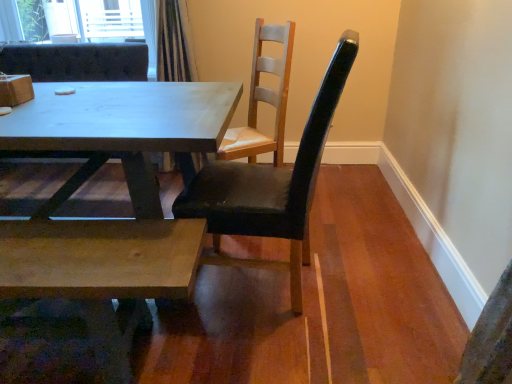
This screenshot has width=512, height=384. What do you see at coordinates (129, 194) in the screenshot? I see `matte wood table at center` at bounding box center [129, 194].

Measure the distance between point (250, 84) and camera.

Point (250, 84) is 2.81 meters from camera.

In order to click on matte white chair at center, arranged as the third chair when viewed from the right in this screenshot , I will do `click(77, 62)`.

This screenshot has width=512, height=384. What do you see at coordinates (271, 186) in the screenshot?
I see `black leather chair at center, acting as the 3th chair starting from the left` at bounding box center [271, 186].

In order to face black leather chair at center, acting as the 3th chair starting from the left, should I rotate leftwards or rightwards?

Rotate your view right by about 0.337°.

In order to click on matte wood table at center in this screenshot , I will do `click(129, 194)`.

Considering the sizes of objects light brown wood chair at upper center, the second chair when ordered from right to left, and natural wood coffee table at lower left in the image provided, who is wider, light brown wood chair at upper center, the second chair when ordered from right to left, or natural wood coffee table at lower left?

Wider between the two is light brown wood chair at upper center, the second chair when ordered from right to left.

Can you confirm if light brown wood chair at upper center, acting as the second chair starting from the left, is smaller than natural wood coffee table at lower left?

No, light brown wood chair at upper center, acting as the second chair starting from the left, is not smaller than natural wood coffee table at lower left.

Do you think light brown wood chair at upper center, the second chair when ordered from right to left, is within natural wood coffee table at lower left, or outside of it?

light brown wood chair at upper center, the second chair when ordered from right to left, is not enclosed by natural wood coffee table at lower left.

From the image's perspective, which chair is the 3rd one above the natural wood coffee table at lower left? Please provide its 2D coordinates.

[(263, 99)]

Is wooden box at upper left inside matte white chair at center, arranged as the third chair when viewed from the right?

No, wooden box at upper left is not inside matte white chair at center, arranged as the third chair when viewed from the right.

From the picture: From a real-world perspective, relative to wooden box at upper left, is matte white chair at center, placed as the 1th chair when sorted from left to right, vertically above or below?

Clearly, from a real-world perspective, matte white chair at center, placed as the 1th chair when sorted from left to right, is below wooden box at upper left.

Can you confirm if matte white chair at center, placed as the 1th chair when sorted from left to right, is taller than wooden box at upper left?

Yes, matte white chair at center, placed as the 1th chair when sorted from left to right, is taller than wooden box at upper left.

Could you tell me if matte white chair at center, arranged as the third chair when viewed from the right, is turned towards wooden box at upper left?

Yes, matte white chair at center, arranged as the third chair when viewed from the right, faces towards wooden box at upper left.

Is matte white chair at center, arranged as the third chair when viewed from the right, taller or shorter than natural wood coffee table at lower left?

Considering their sizes, matte white chair at center, arranged as the third chair when viewed from the right, has more height than natural wood coffee table at lower left.

In terms of size, does matte white chair at center, arranged as the third chair when viewed from the right, appear bigger or smaller than natural wood coffee table at lower left?

matte white chair at center, arranged as the third chair when viewed from the right, is bigger than natural wood coffee table at lower left.

Is matte white chair at center, placed as the 1th chair when sorted from left to right, positioned with its back to natural wood coffee table at lower left?

That's not correct — matte white chair at center, placed as the 1th chair when sorted from left to right, is not looking away from natural wood coffee table at lower left.

Looking at this image, from a real-world perspective, is matte white chair at center, arranged as the third chair when viewed from the right, physically below natural wood coffee table at lower left?

No, from a real-world perspective, matte white chair at center, arranged as the third chair when viewed from the right, is not beneath natural wood coffee table at lower left.

Does matte white chair at center, arranged as the third chair when viewed from the right, turn towards light brown wood chair at upper center, the second chair when ordered from right to left?

No, matte white chair at center, arranged as the third chair when viewed from the right, is not oriented towards light brown wood chair at upper center, the second chair when ordered from right to left.

Between matte white chair at center, arranged as the third chair when viewed from the right, and light brown wood chair at upper center, acting as the second chair starting from the left, which one appears on the left side from the viewer's perspective?

Positioned to the left is matte white chair at center, arranged as the third chair when viewed from the right.

Are matte white chair at center, placed as the 1th chair when sorted from left to right, and light brown wood chair at upper center, acting as the second chair starting from the left, located far from each other?

No, matte white chair at center, placed as the 1th chair when sorted from left to right, is not far from light brown wood chair at upper center, acting as the second chair starting from the left.

Is point (38, 62) in front of point (244, 146)?

No, it is not.

Would you say black leather chair at center, the first chair viewed from the right, is outside matte wood table at center?

black leather chair at center, the first chair viewed from the right, lies outside matte wood table at center's area.

Between black leather chair at center, acting as the 3th chair starting from the left, and matte wood table at center, which one has less height?

With less height is matte wood table at center.

From a real-world perspective, between black leather chair at center, the first chair viewed from the right, and matte wood table at center, who is vertically lower?

In real-world perspective, matte wood table at center is lower.

Does black leather chair at center, the first chair viewed from the right, come in front of matte wood table at center?

That is True.

Considering the sizes of objects wooden box at upper left and matte white chair at center, placed as the 1th chair when sorted from left to right, in the image provided, who is shorter, wooden box at upper left or matte white chair at center, placed as the 1th chair when sorted from left to right,?

With less height is wooden box at upper left.

Does wooden box at upper left have a greater width compared to matte white chair at center, arranged as the third chair when viewed from the right?

Incorrect, the width of wooden box at upper left does not surpass that of matte white chair at center, arranged as the third chair when viewed from the right.

Considering the relative sizes of wooden box at upper left and matte wood table at center in the image provided, is wooden box at upper left thinner than matte wood table at center?

Correct, the width of wooden box at upper left is less than that of matte wood table at center.

Which object is positioned more to the right, wooden box at upper left or matte wood table at center?

matte wood table at center.

Consider the image. Are wooden box at upper left and matte wood table at center far apart?

No, there isn't a large distance between wooden box at upper left and matte wood table at center.

Does wooden box at upper left have a greater height compared to matte wood table at center?

In fact, wooden box at upper left may be shorter than matte wood table at center.

There is a natural wood coffee table at lower left. At what (x,y) coordinates should I click in order to perform the action: click on the 3rd chair above it (from a real-world perspective). Please return your answer as a coordinate pair (x, y). The width and height of the screenshot is (512, 384). Looking at the image, I should click on (263, 99).

At what (x,y) coordinates should I click in order to perform the action: click on the 2nd chair behind when counting from the wooden box at upper left. Please return your answer as a coordinate pair (x, y). Looking at the image, I should click on (77, 62).

Considering their positions, is matte white chair at center, placed as the 1th chair when sorted from left to right, positioned further to wooden box at upper left than matte wood table at center?

matte white chair at center, placed as the 1th chair when sorted from left to right, lies further to wooden box at upper left than the other object.

From the image, which object appears to be nearer to natural wood coffee table at lower left, wooden box at upper left or black leather chair at center, the first chair viewed from the right?

The object closer to natural wood coffee table at lower left is black leather chair at center, the first chair viewed from the right.

Looking at the image, which one is located further to matte wood table at center, black leather chair at center, acting as the 3th chair starting from the left, or wooden box at upper left?

wooden box at upper left lies further to matte wood table at center than the other object.

Estimate the real-world distances between objects in this image. Which object is further from wooden box at upper left, light brown wood chair at upper center, acting as the second chair starting from the left, or matte wood table at center?

light brown wood chair at upper center, acting as the second chair starting from the left, is further to wooden box at upper left.

Estimate the real-world distances between objects in this image. Which object is closer to matte wood table at center, natural wood coffee table at lower left or black leather chair at center, acting as the 3th chair starting from the left?

The object closer to matte wood table at center is natural wood coffee table at lower left.

Looking at the image, which one is located closer to natural wood coffee table at lower left, wooden box at upper left or matte wood table at center?

matte wood table at center is positioned closer to the anchor natural wood coffee table at lower left.

From the image, which object appears to be nearer to black leather chair at center, acting as the 3th chair starting from the left, light brown wood chair at upper center, the second chair when ordered from right to left, or matte white chair at center, arranged as the third chair when viewed from the right?

Among the two, light brown wood chair at upper center, the second chair when ordered from right to left, is located nearer to black leather chair at center, acting as the 3th chair starting from the left.

From the picture: When comparing their distances from matte white chair at center, arranged as the third chair when viewed from the right, does light brown wood chair at upper center, acting as the second chair starting from the left, or black leather chair at center, acting as the 3th chair starting from the left, seem further?

black leather chair at center, acting as the 3th chair starting from the left, is further to matte white chair at center, arranged as the third chair when viewed from the right.

Find the location of `kitchen & dining room table located between wooden box at upper left and black leather chair at center, the first chair viewed from the right, in the left-right direction`. kitchen & dining room table located between wooden box at upper left and black leather chair at center, the first chair viewed from the right, in the left-right direction is located at coordinates (129, 194).

In order to click on chair between wooden box at upper left and black leather chair at center, acting as the 3th chair starting from the left, from left to right in this screenshot , I will do coord(263,99).

Image resolution: width=512 pixels, height=384 pixels. Find the location of `coffee table located between wooden box at upper left and light brown wood chair at upper center, acting as the second chair starting from the left, in the left-right direction`. coffee table located between wooden box at upper left and light brown wood chair at upper center, acting as the second chair starting from the left, in the left-right direction is located at coordinates (102, 272).

You are a GUI agent. You are given a task and a screenshot of the screen. Output one action in this format:
    pyautogui.click(x=<x>, y=<y>)
    Task: Click on the coffee table between matte white chair at center, placed as the 1th chair when sorted from left to right, and black leather chair at center, acting as the 3th chair starting from the left
    This screenshot has height=384, width=512.
    Given the screenshot: What is the action you would take?
    pyautogui.click(x=102, y=272)